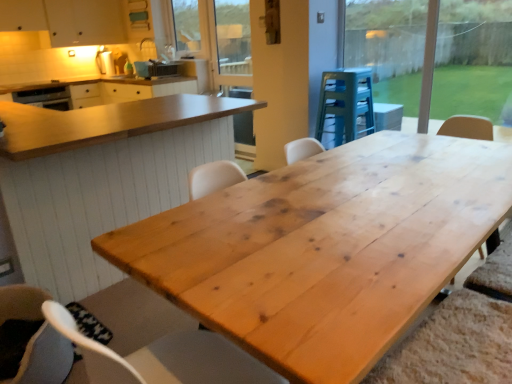
Question: From the image's perspective, is transparent glass window at upper right beneath natural wood table at center, which is the first table from front to back?

Choices:
 (A) yes
 (B) no

Answer: (B)

Question: Is transparent glass window at upper right at the left side of natural wood table at center, arranged as the 2th table when viewed from the back?

Choices:
 (A) no
 (B) yes

Answer: (A)

Question: Is there a large distance between transparent glass window at upper right and natural wood table at center, which is the first table from front to back?

Choices:
 (A) yes
 (B) no

Answer: (A)

Question: Is the depth of transparent glass window at upper right less than that of natural wood table at center, arranged as the 2th table when viewed from the back?

Choices:
 (A) no
 (B) yes

Answer: (A)

Question: Is transparent glass window at upper right behind natural wood table at center, arranged as the 2th table when viewed from the back?

Choices:
 (A) no
 (B) yes

Answer: (B)

Question: Is transparent glass window at upper right touching natural wood table at center, arranged as the 2th table when viewed from the back?

Choices:
 (A) yes
 (B) no

Answer: (B)

Question: Is clear glass window screen at upper center not within wooden screen door at upper center?

Choices:
 (A) no
 (B) yes

Answer: (B)

Question: Are clear glass window screen at upper center and wooden screen door at upper center beside each other?

Choices:
 (A) yes
 (B) no

Answer: (B)

Question: Does clear glass window screen at upper center have a greater height compared to wooden screen door at upper center?

Choices:
 (A) no
 (B) yes

Answer: (A)

Question: From a real-world perspective, is clear glass window screen at upper center positioned under wooden screen door at upper center based on gravity?

Choices:
 (A) no
 (B) yes

Answer: (A)

Question: Is clear glass window screen at upper center positioned with its back to wooden screen door at upper center?

Choices:
 (A) no
 (B) yes

Answer: (A)

Question: Can you confirm if clear glass window screen at upper center is thinner than wooden screen door at upper center?

Choices:
 (A) yes
 (B) no

Answer: (B)

Question: Is transparent glass window at upper right far from wooden screen door at upper center?

Choices:
 (A) yes
 (B) no

Answer: (A)